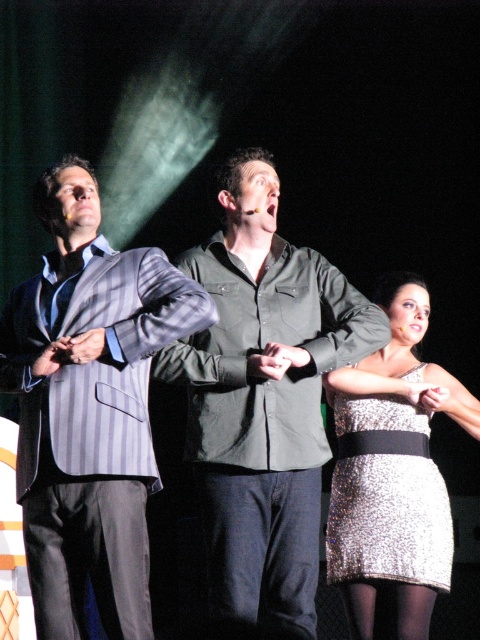
Question: Is gray striped suit at left to the left of sparkly silver dress at center from the viewer's perspective?

Choices:
 (A) yes
 (B) no

Answer: (A)

Question: Which object is the closest to the sparkly silver dress at center?

Choices:
 (A) matte green shirt at center
 (B) gray striped suit at left

Answer: (A)

Question: Which of the following is the closest to the observer?

Choices:
 (A) (202, 266)
 (B) (403, 404)

Answer: (A)

Question: Does matte green shirt at center appear on the right side of sparkly silver dress at center?

Choices:
 (A) yes
 (B) no

Answer: (B)

Question: Observing the image, what is the correct spatial positioning of gray striped suit at left in reference to matte green shirt at center?

Choices:
 (A) above
 (B) below

Answer: (A)

Question: Which point is closer to the camera?

Choices:
 (A) (369, 467)
 (B) (115, 374)

Answer: (B)